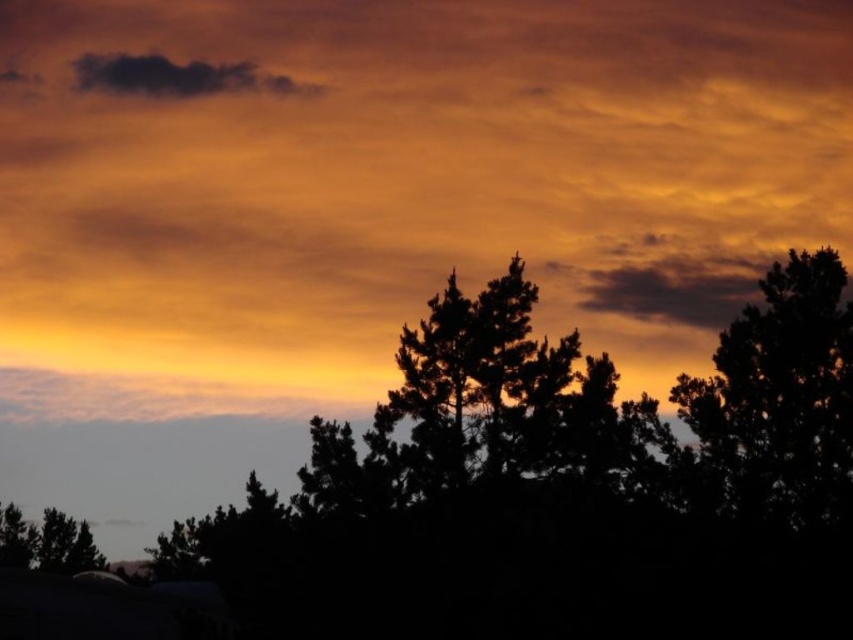
You are an artist painting the sunset scene. You want to ensure the silhouette tree at right and dark gray cloud at upper left are proportionally accurate. Which object should you draw first to maintain their relative sizes?

The silhouette tree at right is smaller than the dark gray cloud at upper left. To maintain their relative sizes, you should draw the dark gray cloud at upper left first as it is larger, then scale down the silhouette tree at right accordingly.